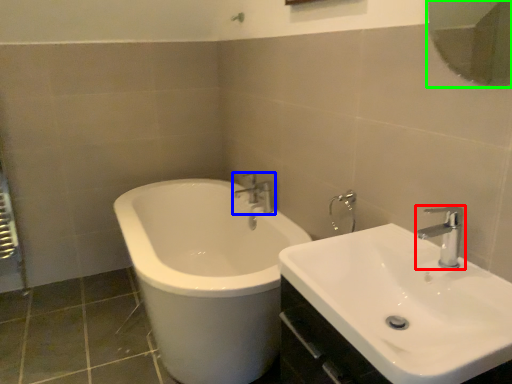
Question: Considering the real-world distances, which object is farthest from tap (highlighted by a red box)? tap (highlighted by a blue box) or mirror (highlighted by a green box)?

Choices:
 (A) tap
 (B) mirror

Answer: (B)